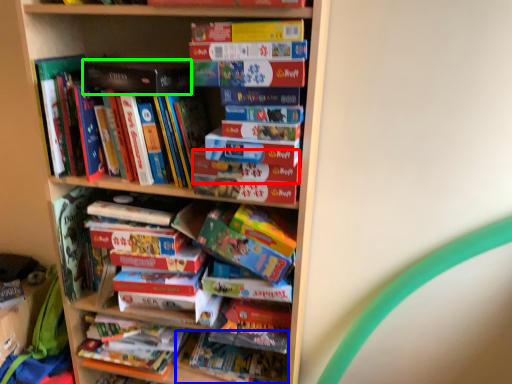
Question: Estimate the real-world distances between objects in this image. Which object is farther from paperback book (highlighted by a red box), book (highlighted by a blue box) or paperback book (highlighted by a green box)?

Choices:
 (A) book
 (B) paperback book

Answer: (A)